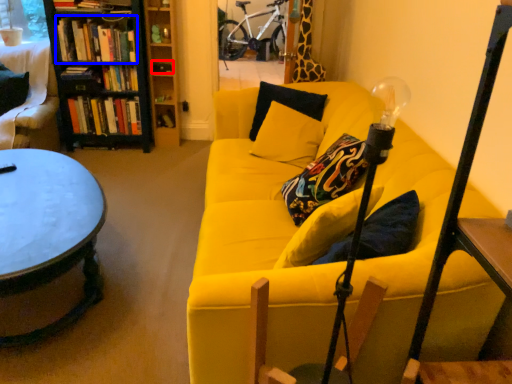
Question: Which object is further to the camera taking this photo, book (highlighted by a red box) or book (highlighted by a blue box)?

Choices:
 (A) book
 (B) book

Answer: (A)